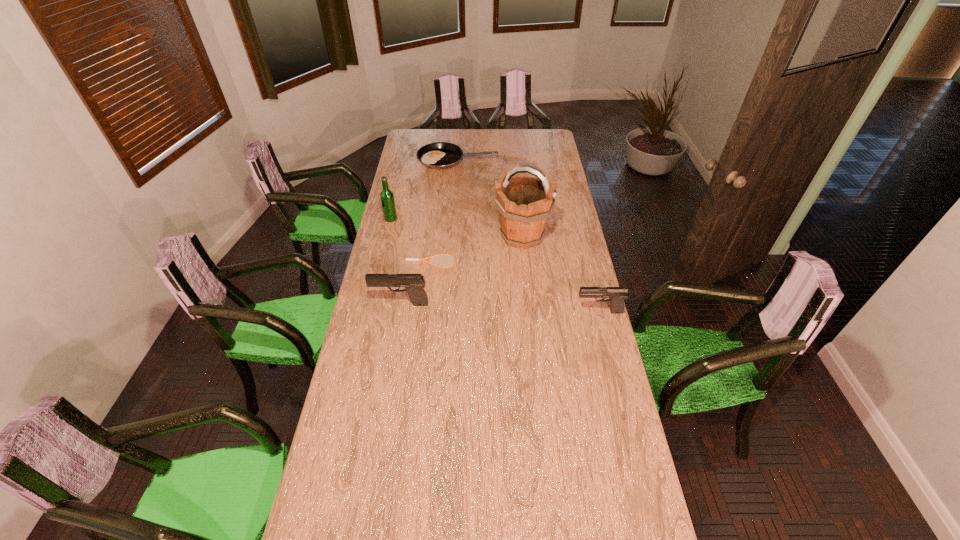
Identify the location of pistol positioned at the right edge. This screenshot has height=540, width=960. (616, 295).

Locate an element on the screen. bucket positioned at the right edge is located at coordinates (524, 203).

Where is `blank space at the far edge of the desktop`? blank space at the far edge of the desktop is located at coordinates (478, 147).

Identify the location of vacant position at the near edge of the desktop. (467, 476).

Where is `vacant space at the left edge of the desktop`? The height and width of the screenshot is (540, 960). vacant space at the left edge of the desktop is located at coordinates (372, 271).

In the image, there is a desktop. Identify the location of vacant region at the right edge. (568, 325).

This screenshot has height=540, width=960. Find the location of `free location at the near left corner`. free location at the near left corner is located at coordinates (322, 499).

Where is `free space that is in between the farthest object and the fifth shortest object`? Image resolution: width=960 pixels, height=540 pixels. free space that is in between the farthest object and the fifth shortest object is located at coordinates (424, 190).

Locate an element on the screen. unoccupied area between the shortest object and the second shortest object is located at coordinates (444, 211).

Where is `empty location between the farther pistol and the second shortest object`? This screenshot has width=960, height=540. empty location between the farther pistol and the second shortest object is located at coordinates (429, 232).